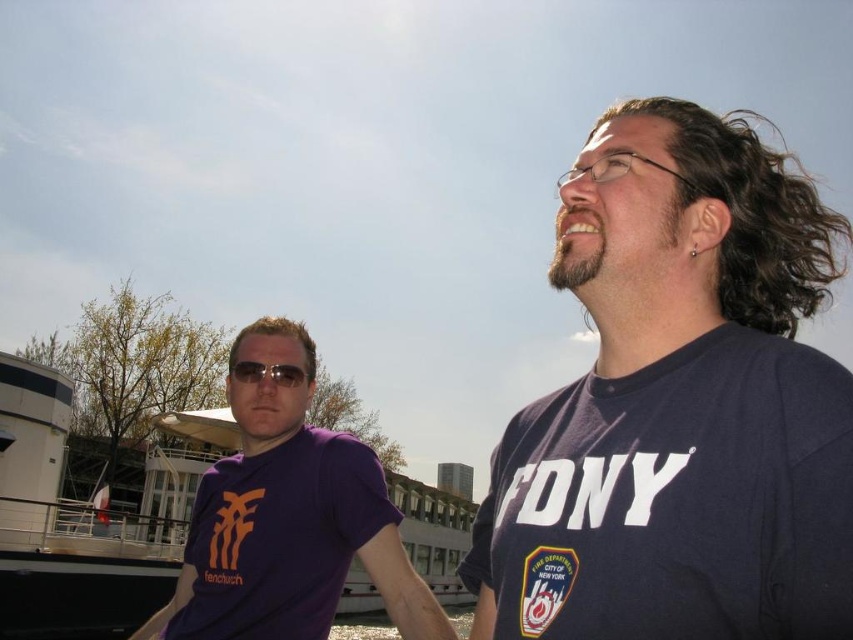
You are standing at the origin point in the image. There is a point marked at coordinates (288, 518). Which object from the list below is this point located on? Choose from the objects listed in the scene description. The objects are the two people and their clothing items. The options are the dark blue T shirt with FDNY, the purple T shirt with orange text and graphics, the badge emblem, the glasses, the sunglasses, the long curly hair, and the short light colored hair.

The point at coordinates (288, 518) is located on the purple matte t shirt at left.